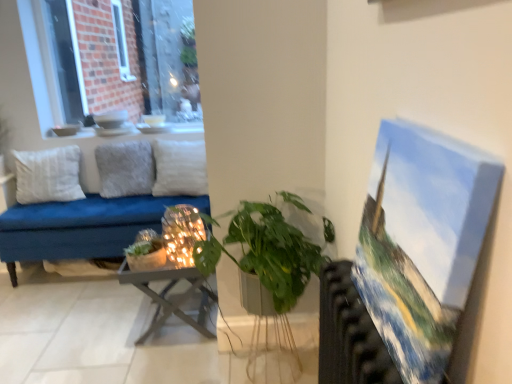
What is the approximate width of fuzzy gray pillow at center, arranged as the second pillow when viewed from the right?

7.47 inches.

This screenshot has width=512, height=384. Describe the element at coordinates (125, 169) in the screenshot. I see `fuzzy gray pillow at center, arranged as the second pillow when viewed from the right` at that location.

The height and width of the screenshot is (384, 512). Identify the location of metallic gray table at center. (167, 292).

Image resolution: width=512 pixels, height=384 pixels. What do you see at coordinates (167, 292) in the screenshot? I see `metallic gray table at center` at bounding box center [167, 292].

What do you see at coordinates (349, 334) in the screenshot? Image resolution: width=512 pixels, height=384 pixels. I see `metallic radiator at right` at bounding box center [349, 334].

Describe the element at coordinates (422, 241) in the screenshot. The height and width of the screenshot is (384, 512). I see `oil paint canvas at right` at that location.

This screenshot has height=384, width=512. Identify the location of white cotton pillow at left, acting as the 3th pillow starting from the right. (48, 175).

Is green matte plant at center, which appears as the first houseplant when viewed from the back, outside of fuzzy gray pillow at center, positioned as the 2th pillow in left-to-right order?

green matte plant at center, which appears as the first houseplant when viewed from the back, lies outside fuzzy gray pillow at center, positioned as the 2th pillow in left-to-right order,'s area.

From a real-world perspective, which object rests below the other?

From a 3D spatial view, green matte plant at center, which is counted as the second houseplant, starting from the front, is below.

Which is less distant, (148, 245) or (103, 194)?

The point (148, 245) is in front.

Which object is positioned more to the right, green matte plant at center, which appears as the first houseplant when viewed from the back, or fuzzy gray pillow at center, arranged as the second pillow when viewed from the right?

green matte plant at center, which appears as the first houseplant when viewed from the back, is more to the right.

Is iridescent glass candle holder at center situated inside brick wall at upper left or outside?

iridescent glass candle holder at center cannot be found inside brick wall at upper left.

Does iridescent glass candle holder at center have a greater height compared to brick wall at upper left?

No, iridescent glass candle holder at center is not taller than brick wall at upper left.

From the image's perspective, which one is positioned higher, iridescent glass candle holder at center or brick wall at upper left?

brick wall at upper left, from the image's perspective.

Who is more distant, iridescent glass candle holder at center or brick wall at upper left?

brick wall at upper left is further from the camera.

Which is behind, point (329, 292) or point (438, 179)?

Point (329, 292)

In the image, is metallic radiator at right positioned in front of or behind oil paint canvas at right?

In the image, metallic radiator at right appears behind oil paint canvas at right.

Considering the positions of objects metallic radiator at right and oil paint canvas at right in the image provided, who is more to the left, metallic radiator at right or oil paint canvas at right?

metallic radiator at right is more to the left.

Can you confirm if metallic radiator at right is shorter than oil paint canvas at right?

Incorrect, the height of metallic radiator at right does not fall short of that of oil paint canvas at right.

From a real-world perspective, between green matte plant at center, which is counted as the second houseplant, starting from the back, and fuzzy gray pillow at center, arranged as the second pillow when viewed from the right, who is vertically higher?

From a 3D spatial view, fuzzy gray pillow at center, arranged as the second pillow when viewed from the right, is above.

From the image's perspective, which object appears higher, green matte plant at center, the first houseplant viewed from the right, or fuzzy gray pillow at center, arranged as the second pillow when viewed from the right?

fuzzy gray pillow at center, arranged as the second pillow when viewed from the right, appears higher in the image.

Would you consider green matte plant at center, the 2th houseplant when ordered from left to right, to be distant from fuzzy gray pillow at center, arranged as the second pillow when viewed from the right?

That's right, there is a large distance between green matte plant at center, the 2th houseplant when ordered from left to right, and fuzzy gray pillow at center, arranged as the second pillow when viewed from the right.

Which object is more forward, green matte plant at center, which is counted as the 1th houseplant, starting from the front, or fuzzy gray pillow at center, arranged as the second pillow when viewed from the right?

green matte plant at center, which is counted as the 1th houseplant, starting from the front, is closer to the camera.

Is metallic gray table at center taller or shorter than metallic radiator at right?

metallic gray table at center is shorter than metallic radiator at right.

Looking at this image, how many degrees apart are the facing directions of metallic gray table at center and metallic radiator at right?

0.629 degrees.

From a real-world perspective, is metallic gray table at center on metallic radiator at right?

No.

Based on the photo, which point is more distant from viewer, (201, 287) or (342, 323)?

The point (201, 287) is farther from the camera.

Between metallic radiator at right and brick wall at upper left, which one has more height?

With more height is brick wall at upper left.

Does point (322, 354) come in front of point (29, 11)?

Yes, it is.

Could you tell me if metallic radiator at right is turned towards brick wall at upper left?

No, metallic radiator at right is not facing towards brick wall at upper left.

Looking at their sizes, would you say metallic radiator at right is wider or thinner than brick wall at upper left?

In the image, metallic radiator at right appears to be wider than brick wall at upper left.

From the image's perspective, between white cotton pillow at left, which appears as the 1th pillow when viewed from the left, and brick wall at upper left, who is located below?

white cotton pillow at left, which appears as the 1th pillow when viewed from the left, from the image's perspective.

Considering the relative sizes of white cotton pillow at left, acting as the 3th pillow starting from the right, and brick wall at upper left in the image provided, is white cotton pillow at left, acting as the 3th pillow starting from the right, smaller than brick wall at upper left?

Yes, white cotton pillow at left, acting as the 3th pillow starting from the right, is smaller than brick wall at upper left.

Measure the distance between white cotton pillow at left, which appears as the 1th pillow when viewed from the left, and brick wall at upper left.

white cotton pillow at left, which appears as the 1th pillow when viewed from the left, is 14.12 inches away from brick wall at upper left.

Considering the sizes of objects white cotton pillow at left, acting as the 3th pillow starting from the right, and brick wall at upper left in the image provided, who is thinner, white cotton pillow at left, acting as the 3th pillow starting from the right, or brick wall at upper left?

brick wall at upper left.

Locate an element on the screen. the 2nd pillow above when counting from the green matte plant at center, the first houseplant in the left-to-right sequence (from the image's perspective) is located at coordinates click(125, 169).

Image resolution: width=512 pixels, height=384 pixels. I want to click on window located on the left of iridescent glass candle holder at center, so click(x=36, y=66).

In the scene shown: Estimate the real-world distances between objects in this image. Which object is closer to brick wall at upper left, metallic radiator at right or metallic gray table at center?

Among the two, metallic gray table at center is located nearer to brick wall at upper left.

Which object lies further to the anchor point fuzzy gray pillow at center, arranged as the second pillow when viewed from the right, metallic radiator at right or brick wall at upper left?

Among the two, metallic radiator at right is located further to fuzzy gray pillow at center, arranged as the second pillow when viewed from the right.

From the image, which object appears to be nearer to iridescent glass candle holder at center, brick wall at upper left or metallic radiator at right?

metallic radiator at right lies closer to iridescent glass candle holder at center than the other object.

Looking at this image, from the image, which object appears to be nearer to oil paint canvas at right, metallic gray table at center or green matte plant at center, the first houseplant in the left-to-right sequence?

Among the two, metallic gray table at center is located nearer to oil paint canvas at right.

Based on their spatial positions, is oil paint canvas at right or white cotton pillow at left, which appears as the 1th pillow when viewed from the left, closer to white soft pillow at center, positioned as the first pillow in right-to-left order?

Among the two, white cotton pillow at left, which appears as the 1th pillow when viewed from the left, is located nearer to white soft pillow at center, positioned as the first pillow in right-to-left order.

Considering their positions, is metallic radiator at right positioned further to oil paint canvas at right than white ceramic vase at upper center?

Among the two, white ceramic vase at upper center is located further to oil paint canvas at right.

Based on their spatial positions, is oil paint canvas at right or fuzzy gray pillow at center, arranged as the second pillow when viewed from the right, further from white ceramic vase at upper center?

oil paint canvas at right is further to white ceramic vase at upper center.

Estimate the real-world distances between objects in this image. Which object is closer to iridescent glass candle holder at center, metallic radiator at right or brick wall at upper left?

metallic radiator at right is closer to iridescent glass candle holder at center.

Identify the location of window sill situated between white cotton pillow at left, acting as the 3th pillow starting from the right, and fuzzy gray pillow at center, arranged as the second pillow when viewed from the right, from left to right. (138, 133).

Where is `houseplant situated between white cotton pillow at left, acting as the 3th pillow starting from the right, and white soft pillow at center, the third pillow viewed from the left, from left to right`? houseplant situated between white cotton pillow at left, acting as the 3th pillow starting from the right, and white soft pillow at center, the third pillow viewed from the left, from left to right is located at coordinates (146, 254).

Find the location of `houseplant located between white cotton pillow at left, which appears as the 1th pillow when viewed from the left, and green matte plant at center, which is counted as the 1th houseplant, starting from the front, in the left-right direction`. houseplant located between white cotton pillow at left, which appears as the 1th pillow when viewed from the left, and green matte plant at center, which is counted as the 1th houseplant, starting from the front, in the left-right direction is located at coordinates (146, 254).

Identify the location of candle holder located between green matte plant at center, which is counted as the second houseplant, starting from the back, and fuzzy gray pillow at center, arranged as the second pillow when viewed from the right, in the depth direction. (182, 233).